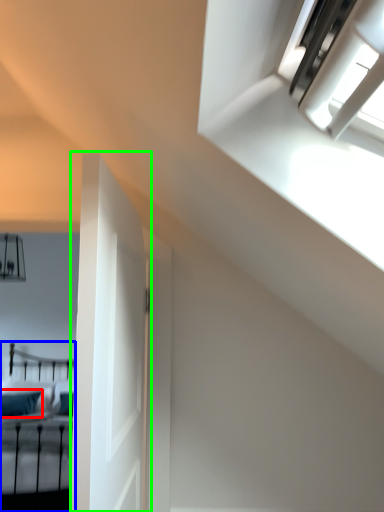
Question: Based on their relative distances, which object is nearer to pillow (highlighted by a red box)? Choose from bed (highlighted by a blue box) and door (highlighted by a green box).

Choices:
 (A) bed
 (B) door

Answer: (A)